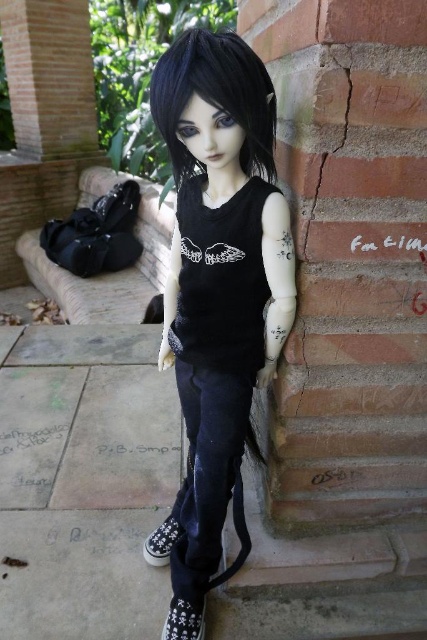
Between matte black doll at center and black canvas shoe at lower left, which one has more height?

matte black doll at center is taller.

Is point (274, 342) behind point (166, 525)?

No, (274, 342) is in front of (166, 525).

You are a GUI agent. You are given a task and a screenshot of the screen. Output one action in this format:
    pyautogui.click(x=<x>, y=<y>)
    Task: Click on the matte black doll at center
    This screenshot has width=427, height=640.
    Given the screenshot: What is the action you would take?
    pyautogui.click(x=219, y=278)

Is point (181, 396) closer to viewer compared to point (256, 140)?

That is False.

Between point (183, 177) and point (202, 40), which one is positioned in front?

Point (202, 40) is more forward.

At what (x,y) coordinates should I click in order to perform the action: click on matte black doll at center. Please return your answer as a coordinate pair (x, y). The height and width of the screenshot is (640, 427). Looking at the image, I should click on (219, 278).

Identify the location of black matte hair at upper center. (215, 97).

Which of these two, black matte hair at upper center or black canvas shoe at lower left, stands shorter?

With less height is black canvas shoe at lower left.

Does point (187, 154) lie in front of point (166, 536)?

Yes, it is.

Image resolution: width=427 pixels, height=640 pixels. Identify the location of black matte hair at upper center. (215, 97).